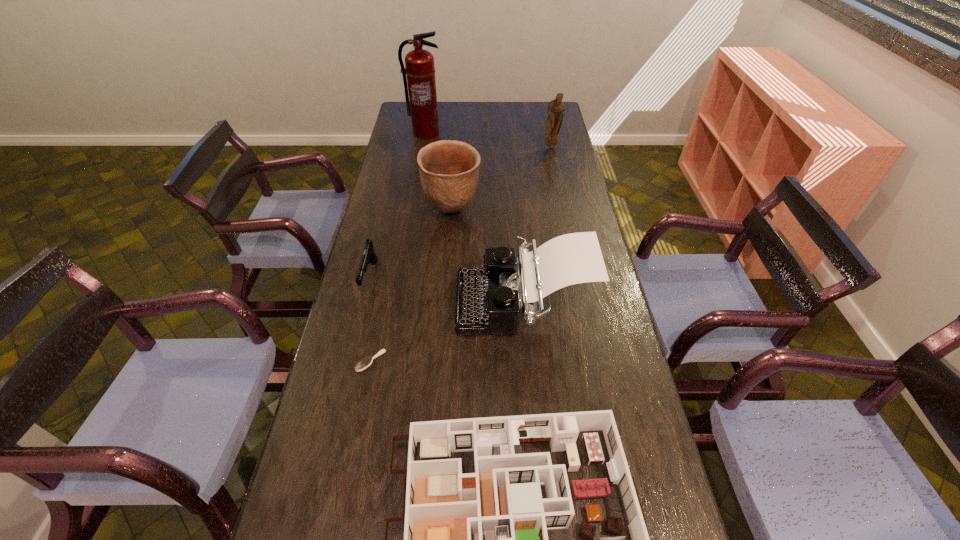
This screenshot has height=540, width=960. In order to click on free space that satisfies the following two spatial constraints: 1. on the side of the fire extinguisher with the handle and hose; 2. on the right side of the third farthest object in this screenshot , I will do `click(412, 210)`.

In order to click on blank space that satisfies the following two spatial constraints: 1. at the aiming end of the scrubbing brush; 2. on the right side of the gun in this screenshot , I will do `click(350, 361)`.